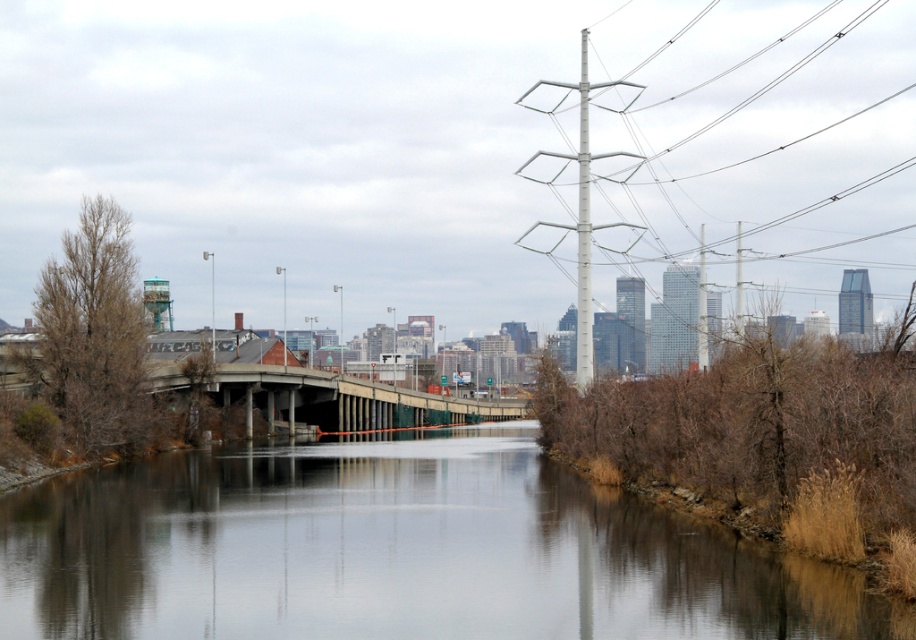
You are a city planner analyzing the image of the urban landscape. You need to determine which object occupies a larger area in the image. Which one is bigger between the smooth concrete river at center and the concrete bridge at center?

The concrete bridge at center is larger than the smooth concrete river at center according to the description.

You are a city planner assessing the river and bridge in the image. Given that the river must accommodate boats up to 10 meters wide, does the smooth concrete river at center have sufficient width compared to the concrete bridge at center?

The smooth concrete river at center is narrower than the concrete bridge at center. Since the bridge is wider, the river itself must be at least as wide as the bridge to accommodate boats up to 10 meters. However, since the river is narrower, it may not be sufficient. Therefore, the river might not have enough width for the boats.

You are a city planner reviewing the urban layout. The smooth concrete river at center is a key feature. Where exactly is it located in the image coordinates?

The smooth concrete river at center is located at point coordinates of [398,552].